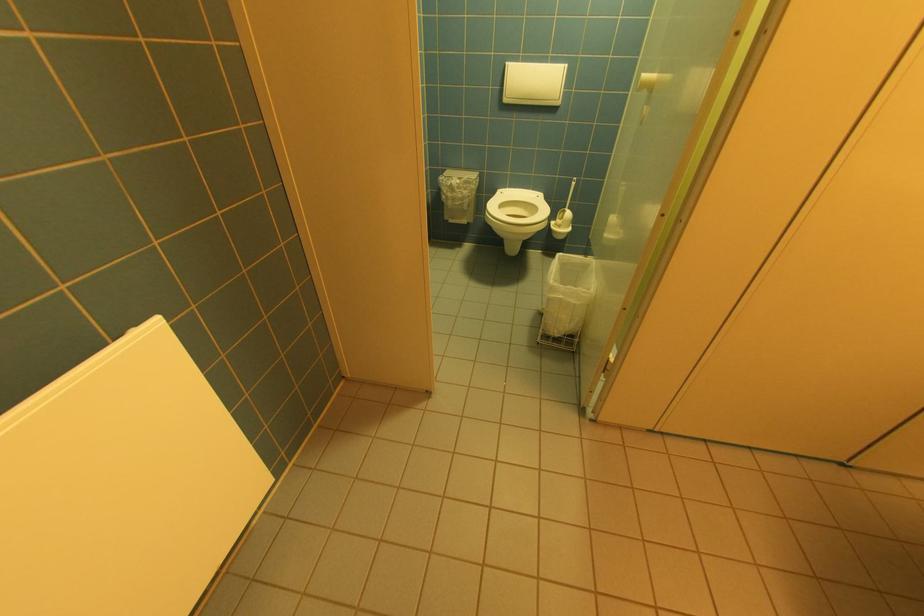
The width and height of the screenshot is (924, 616). What do you see at coordinates (532, 83) in the screenshot?
I see `the white flush panel` at bounding box center [532, 83].